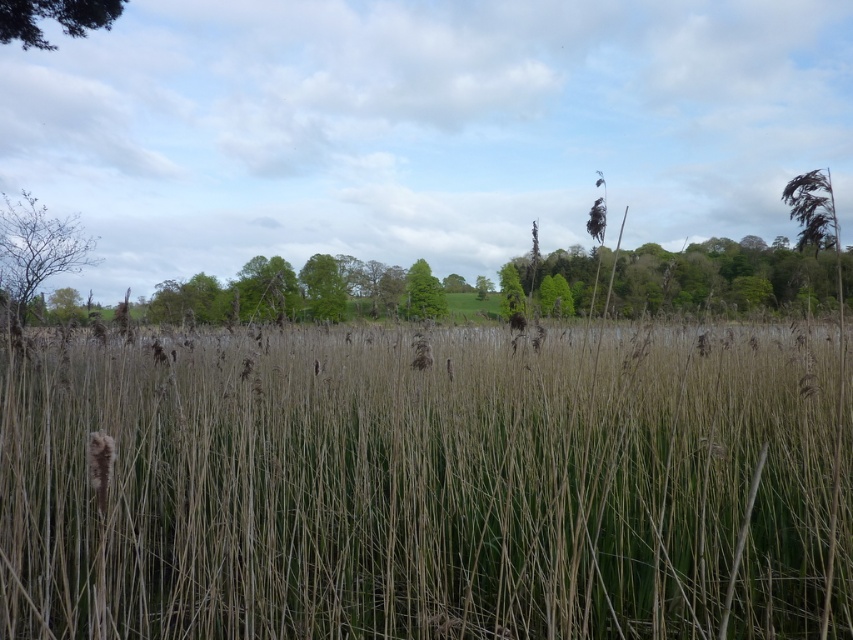
Question: Does bare branches at left come in front of green matte tree at center?

Choices:
 (A) no
 (B) yes

Answer: (B)

Question: Can you confirm if green leafy tree at upper center is positioned below green leafy tree at upper left?

Choices:
 (A) yes
 (B) no

Answer: (A)

Question: Among these points, which one is nearest to the camera?

Choices:
 (A) (20, 243)
 (B) (576, 600)
 (C) (86, 1)
 (D) (430, 278)

Answer: (B)

Question: Is dry grass at center wider than green leafy tree at upper center?

Choices:
 (A) yes
 (B) no

Answer: (B)

Question: Among these points, which one is farthest from the camera?

Choices:
 (A) (717, 284)
 (B) (345, 296)
 (C) (424, 314)

Answer: (A)

Question: Which point is closer to the camera taking this photo?

Choices:
 (A) (422, 310)
 (B) (16, 266)
 (C) (10, 1)
 (D) (351, 371)

Answer: (D)